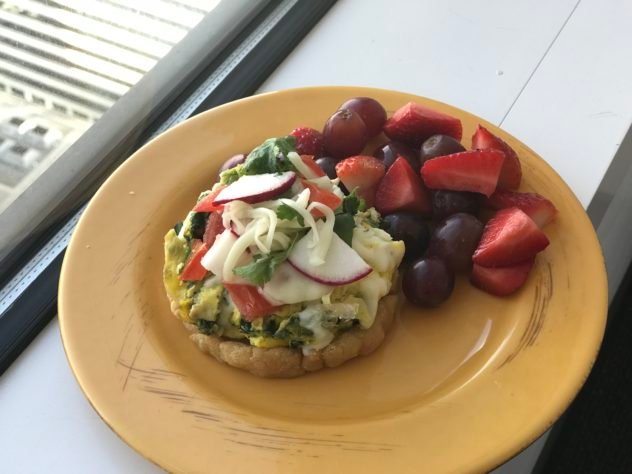
Look for what you would eat food off of in the image and show me where they are. Your answer should be formatted as a list of tuples, i.e. [(x1, y1), (x2, y2), ...], where each tuple contains the x and y coordinates of a point satisfying the conditions above.

[(416, 361)]